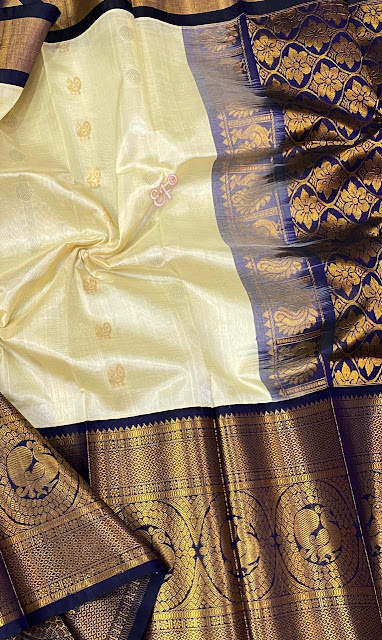
Locate an element on the screen. Image resolution: width=382 pixels, height=640 pixels. folded piece of fabric is located at coordinates (90, 545).